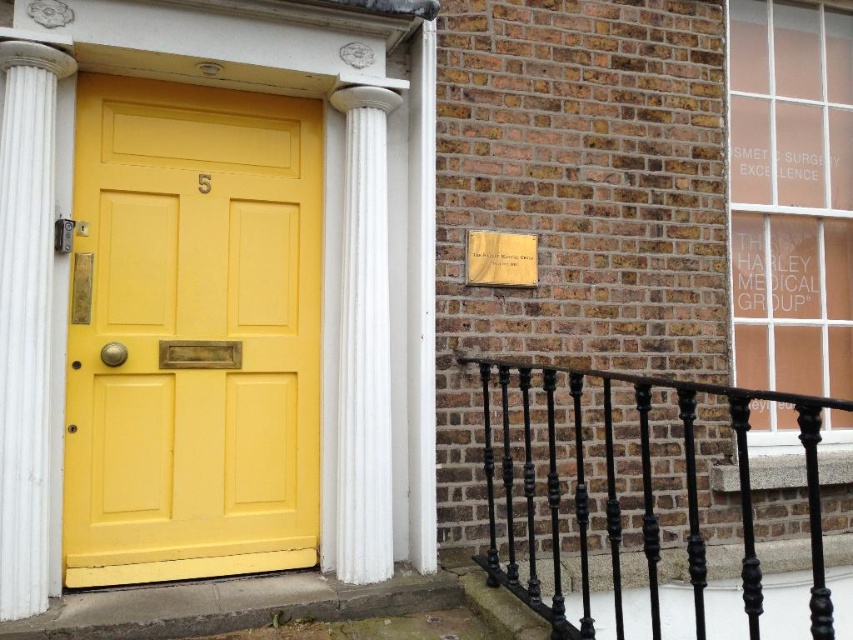
You are a delivery person trying to determine the best path to approach the yellow door while avoiding obstacles. Given that the white marble column at left and the white marble column at center are in your way, which column should you go around to have more space to maneuver?

The white marble column at center occupies more space than the white marble column at left, so you should go around the white marble column at left to have more space to maneuver.

You are a painter who needs to choose between two items to paint first. You have a matte yellow door at center and a black wrought iron railing at lower right. Which item requires more paint due to its larger width?

The black wrought iron railing at lower right requires more paint because it is wider than the matte yellow door at center.